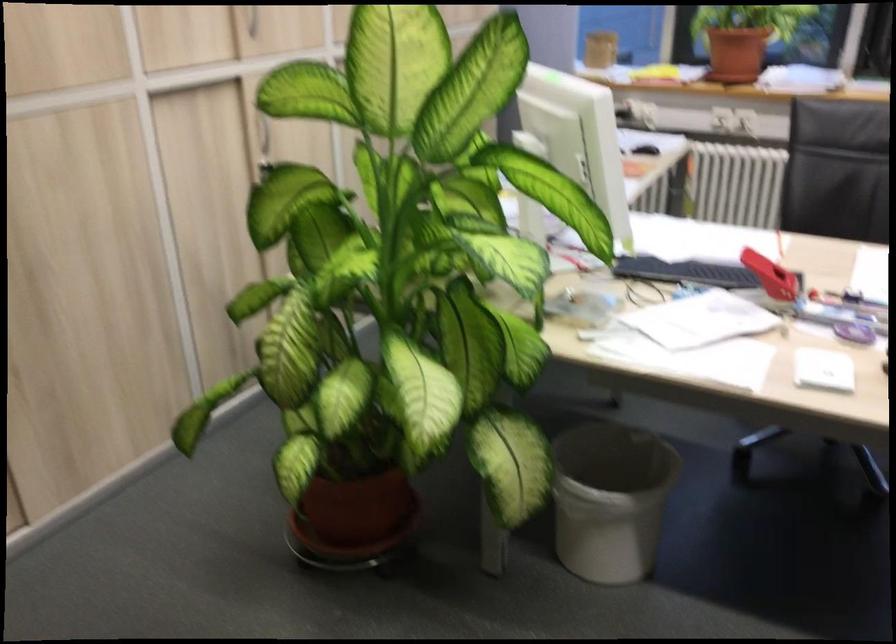
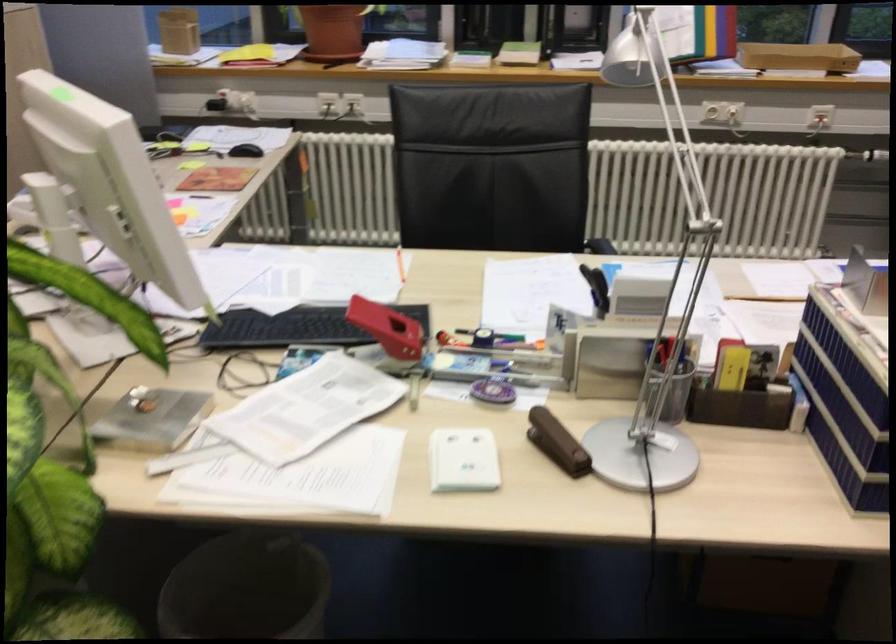
Locate, in the second image, the point that corresponds to pixel 822 248 in the first image.

(453, 265)